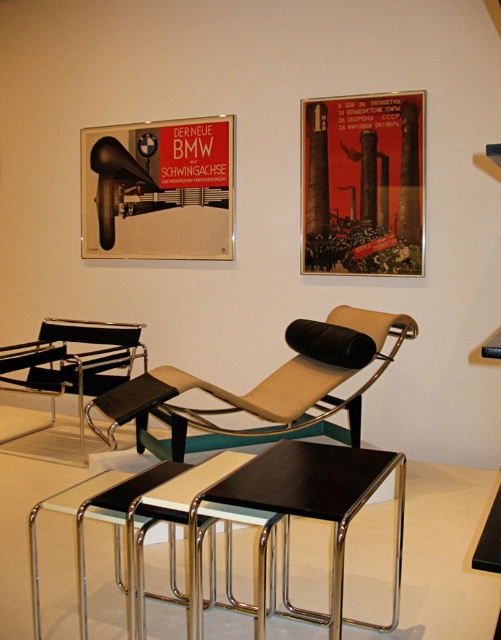
Does matte black speaker at upper left have a larger size compared to black glossy table at center?

Yes.

Which is more to the right, matte black speaker at upper left or black glossy table at center?

From the viewer's perspective, black glossy table at center appears more on the right side.

Is point (124, 195) positioned after point (393, 588)?

Yes, point (124, 195) is farther from viewer.

The image size is (501, 640). Identify the location of matte black speaker at upper left. (158, 189).

What do you see at coordinates (364, 184) in the screenshot? The width and height of the screenshot is (501, 640). I see `red paper poster at upper center` at bounding box center [364, 184].

Is red paper poster at upper center taller than black glossy table at center?

Correct, red paper poster at upper center is much taller as black glossy table at center.

Is point (383, 253) less distant than point (292, 493)?

No, (383, 253) is behind (292, 493).

The image size is (501, 640). I want to click on red paper poster at upper center, so click(364, 184).

Which of these two, matte black speaker at upper left or black leather chair at left, stands shorter?

Standing shorter between the two is black leather chair at left.

Image resolution: width=501 pixels, height=640 pixels. What are the coordinates of `matte black speaker at upper left` in the screenshot? It's located at (158, 189).

Where is `matte black speaker at upper left`? The height and width of the screenshot is (640, 501). matte black speaker at upper left is located at coordinates (158, 189).